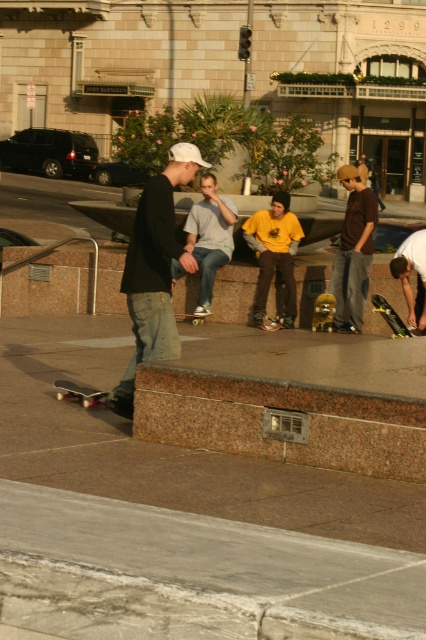
You are a photographer setting up a shot of the skateboarding scene. You need to place a tripod between the dark gray matte skateboard at lower left and the yellow matte skateboard at lower right. Based on their positions, which skateboard will the tripod be closer to?

The dark gray matte skateboard at lower left is positioned on the left side of the yellow matte skateboard at lower right. Since the tripod is placed between them, it will be closer to the dark gray matte skateboard at lower left.

You are a photographer trying to capture both the dark gray matte skateboard at lower left and the wooden deck skateboard at center in a single shot. Based on their positions, which skateboard is closer to the camera?

The dark gray matte skateboard at lower left is closer to the camera because it is positioned below the wooden deck skateboard at center, which suggests it is in a lower plane relative to the camera view.

You are a photographer positioned at the center of the plaza. You want to capture a photo that includes both the matte brown shirt at center and the yellow matte skateboard at lower right. Based on their positions, which object should you adjust your camera angle to focus on first to ensure both are in frame?

The matte brown shirt at center is to the left of the yellow matte skateboard at lower right, so you should focus on the yellow matte skateboard at lower right first to ensure both are included in the frame.